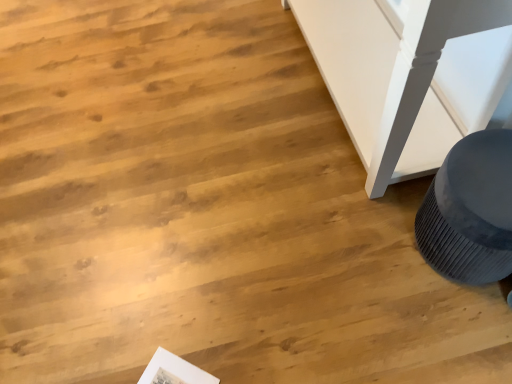
Identify the location of vacant area that is in front of matte gray speaker at lower right. This screenshot has height=384, width=512. (463, 331).